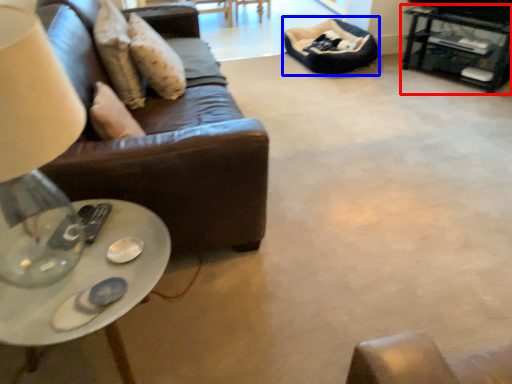
Question: Which of the following is the closest to the observer, table (highlighted by a red box) or bean bag chair (highlighted by a blue box)?

Choices:
 (A) table
 (B) bean bag chair

Answer: (A)